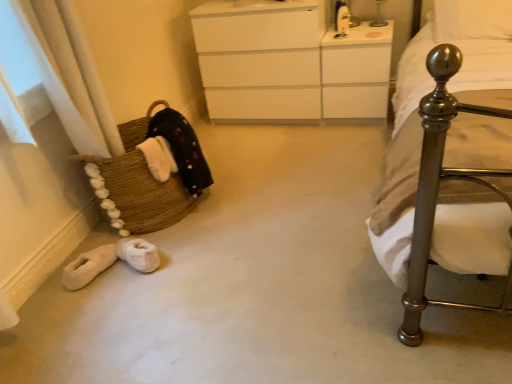
Question: Can you confirm if white glossy vanity at upper center is smaller than metallic glass table lamp at upper center?

Choices:
 (A) yes
 (B) no

Answer: (B)

Question: Can you confirm if white glossy vanity at upper center is positioned to the left of metallic glass table lamp at upper center?

Choices:
 (A) no
 (B) yes

Answer: (B)

Question: Does white glossy vanity at upper center lie in front of metallic glass table lamp at upper center?

Choices:
 (A) yes
 (B) no

Answer: (A)

Question: Does white glossy vanity at upper center turn towards metallic glass table lamp at upper center?

Choices:
 (A) yes
 (B) no

Answer: (B)

Question: Is the depth of white glossy vanity at upper center greater than that of metallic glass table lamp at upper center?

Choices:
 (A) yes
 (B) no

Answer: (B)

Question: Is white glossy vanity at upper center not inside metallic glass table lamp at upper center?

Choices:
 (A) yes
 (B) no

Answer: (A)

Question: Does white matte chest of drawers at center have a greater width compared to white soft pillow at upper right?

Choices:
 (A) yes
 (B) no

Answer: (A)

Question: Are white matte chest of drawers at center and white soft pillow at upper right located far from each other?

Choices:
 (A) no
 (B) yes

Answer: (A)

Question: Considering the relative positions of white matte chest of drawers at center and white soft pillow at upper right in the image provided, is white matte chest of drawers at center to the right of white soft pillow at upper right from the viewer's perspective?

Choices:
 (A) no
 (B) yes

Answer: (A)

Question: From the image's perspective, is white matte chest of drawers at center on top of white soft pillow at upper right?

Choices:
 (A) no
 (B) yes

Answer: (A)

Question: Is white matte chest of drawers at center located outside white soft pillow at upper right?

Choices:
 (A) yes
 (B) no

Answer: (A)

Question: Is white matte chest of drawers at center oriented towards white soft pillow at upper right?

Choices:
 (A) no
 (B) yes

Answer: (A)

Question: Would you say brown woven basket at left contains polished metal bed at right?

Choices:
 (A) no
 (B) yes

Answer: (A)